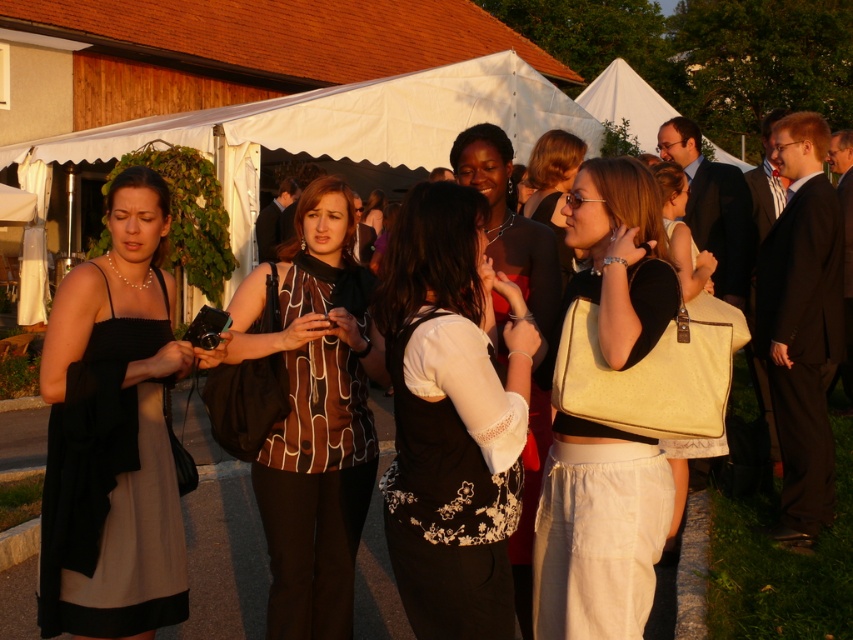
Question: In this image, where is brown printed blouse at center located relative to matte black dress at left?

Choices:
 (A) above
 (B) below

Answer: (A)

Question: Where is white floral vest at center located in relation to matte black dress at center in the image?

Choices:
 (A) above
 (B) below

Answer: (B)

Question: Which object is positioned closest to the matte cream handbag at center?

Choices:
 (A) matte black dress at left
 (B) matte black dress at center
 (C) matte cream purse at center
 (D) white floral vest at center

Answer: (B)

Question: Does matte cream purse at center come in front of matte black dress at left?

Choices:
 (A) yes
 (B) no

Answer: (A)

Question: Which object is farther from the camera taking this photo?

Choices:
 (A) brown printed blouse at center
 (B) matte cream purse at center
 (C) white floral vest at center

Answer: (A)

Question: Considering the real-world distances, which object is closest to the matte black dress at left?

Choices:
 (A) matte black dress at center
 (B) matte cream purse at center
 (C) brown printed blouse at center
 (D) matte cream handbag at center

Answer: (C)